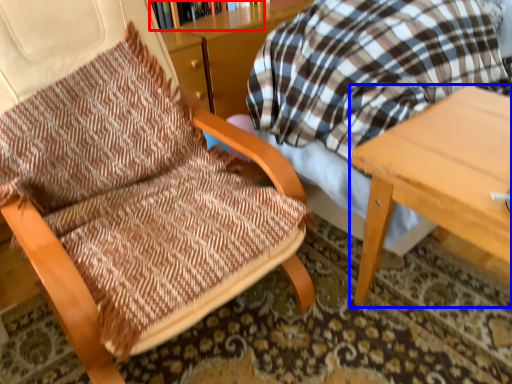
Question: Which object appears farthest to the camera in this image, bookcase (highlighted by a red box) or table (highlighted by a blue box)?

Choices:
 (A) bookcase
 (B) table

Answer: (A)